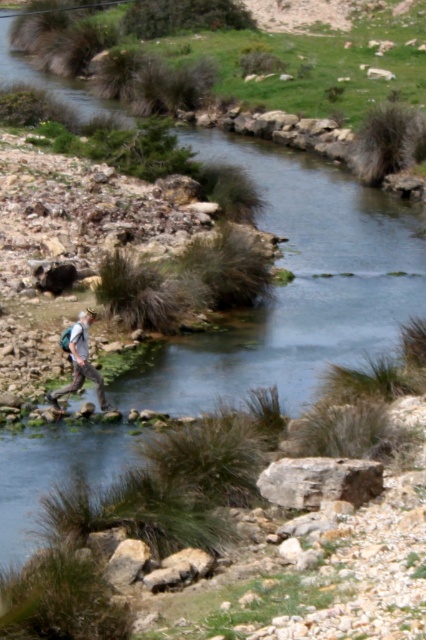
You are a hiker who wants to cross the river using the clearest part of the water. According to the map coordinates provided, where should you aim to step to safely cross the clear water stream at center?

The clear water stream at center is located at point (299, 285), so you should aim to step there to safely cross the clear water stream at center.

You are standing at the edge of the clear water stream at center and want to cross it to the other side. The stream is 14.42 meters away from you. If your backpack has a rope that is 15 meters long, can you safely use the rope to cross the stream?

The clear water stream at center is 14.42 meters away from the viewer. Since the rope is 15 meters long, which is longer than the stream width, you can safely use the rope to cross the stream.